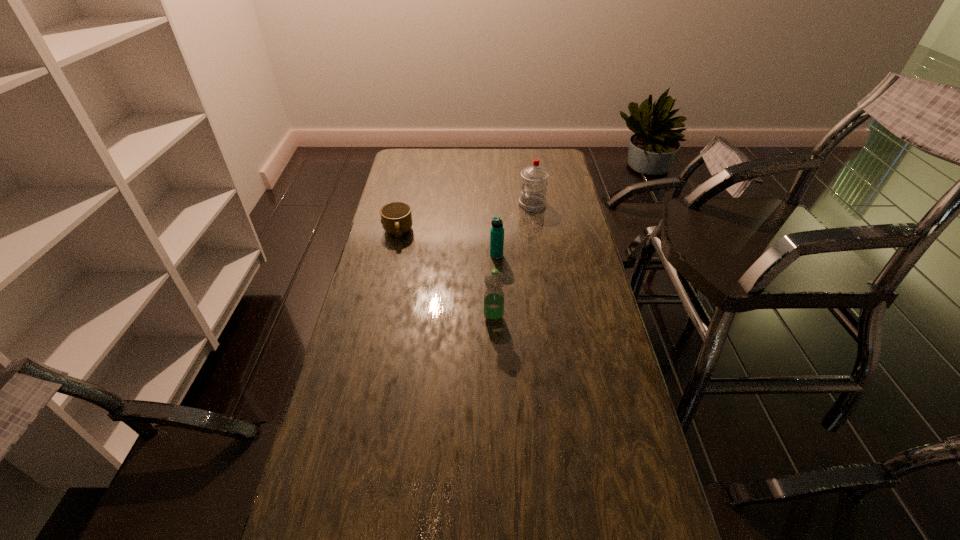
What are the coordinates of `empty space that is in between the third nearest object and the second nearest water bottle` in the screenshot? It's located at (447, 244).

The width and height of the screenshot is (960, 540). Identify the location of vacant area that lies between the nearest water bottle and the farthest water bottle. (513, 261).

Locate an element on the screen. free space between the nearest water bottle and the farthest water bottle is located at coordinates (513, 261).

The image size is (960, 540). I want to click on free space between the rightmost water bottle and the nearest water bottle, so click(x=513, y=261).

This screenshot has width=960, height=540. Find the location of `empty space between the shortest object and the nearest object`. empty space between the shortest object and the nearest object is located at coordinates (445, 275).

Locate an element on the screen. The width and height of the screenshot is (960, 540). empty space between the shortest water bottle and the rightmost object is located at coordinates (515, 230).

You are a GUI agent. You are given a task and a screenshot of the screen. Output one action in this format:
    pyautogui.click(x=<x>, y=<y>)
    Task: Click on the free space that is in between the rightmost water bottle and the second farthest water bottle
    This screenshot has width=960, height=540.
    Given the screenshot: What is the action you would take?
    pyautogui.click(x=515, y=230)

Identify the location of free space between the farthest object and the nearest water bottle. (513, 261).

This screenshot has height=540, width=960. I want to click on free space between the second nearest water bottle and the mug, so click(x=447, y=244).

Locate which object ranks in proximity to the nearest water bottle. Please provide its 2D coordinates. Your answer should be formatted as a tuple, i.e. [(x, y)], where the tuple contains the x and y coordinates of a point satisfying the conditions above.

[(497, 231)]